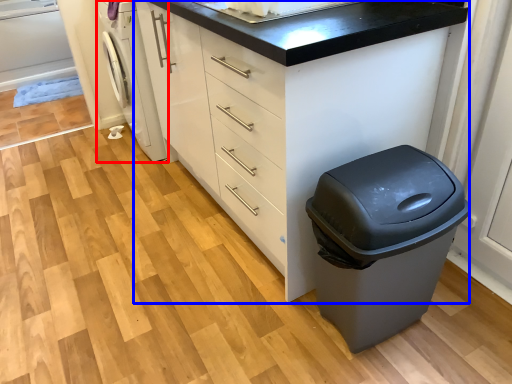
Question: Which of the following is the farthest to the observer, washing machine (highlighted by a red box) or chest of drawers (highlighted by a blue box)?

Choices:
 (A) washing machine
 (B) chest of drawers

Answer: (A)